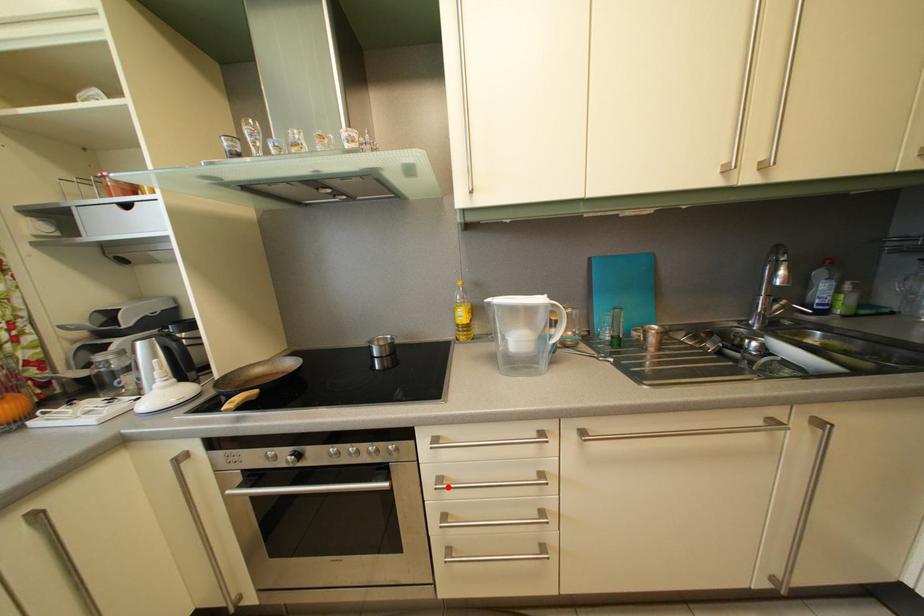
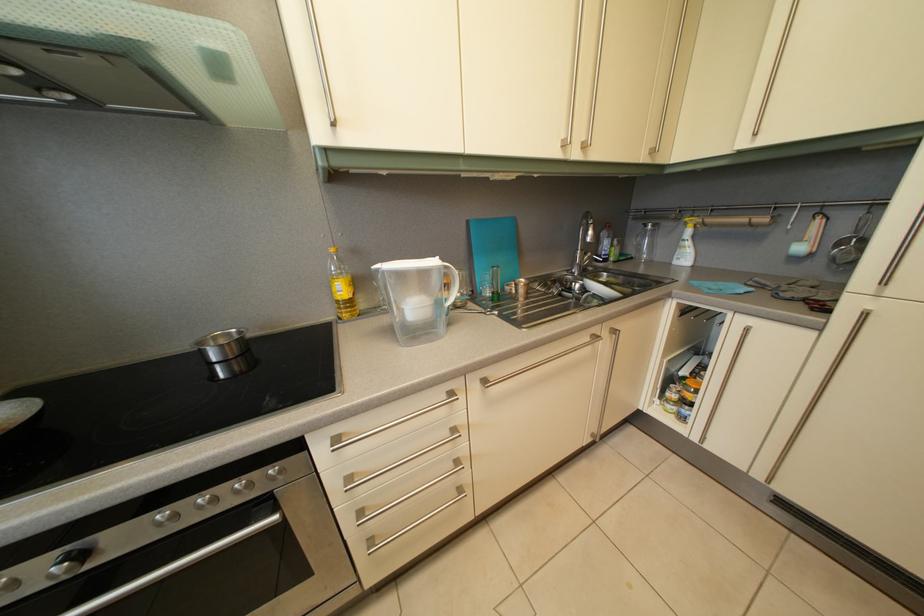
Locate, in the second image, the point that corresponds to the highlighted location in the first image.

(358, 487)